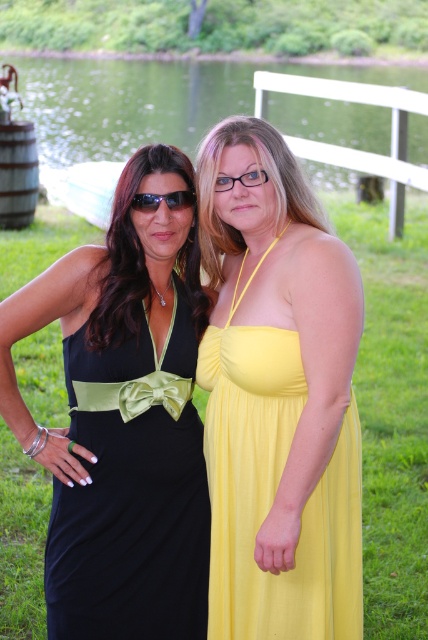
You are standing at the edge of the lake and want to place a picnic blanket on the green grass at lower center. According to the coordinates provided, where exactly should you position the blanket?

The green grass at lower center is located at point (148, 100), so you should position the picnic blanket there.

You are a photographer setting up a tripod to capture the scene. The green grass at lower center and the sunglasses at center are both in your view. Which object should you focus on first if you want to ensure both are in sharp focus?

You should focus on the green grass at lower center first because it is closer to the viewer than the sunglasses at center, ensuring both will be in focus when properly focused on the closer object.

You are a photographer planning to take a photo of the yellow satin dress at center and the green grass at lower center. You need to ensure there is enough space between them for a drone to fly through. The drone requires a minimum of 60 feet of clearance between the two objects. Based on the scene, can the drone safely pass between them?

The yellow satin dress at center and green grass at lower center are 69.82 feet apart from each other, which exceeds the drone requirement of 60 feet. Therefore, the drone can safely pass between them.